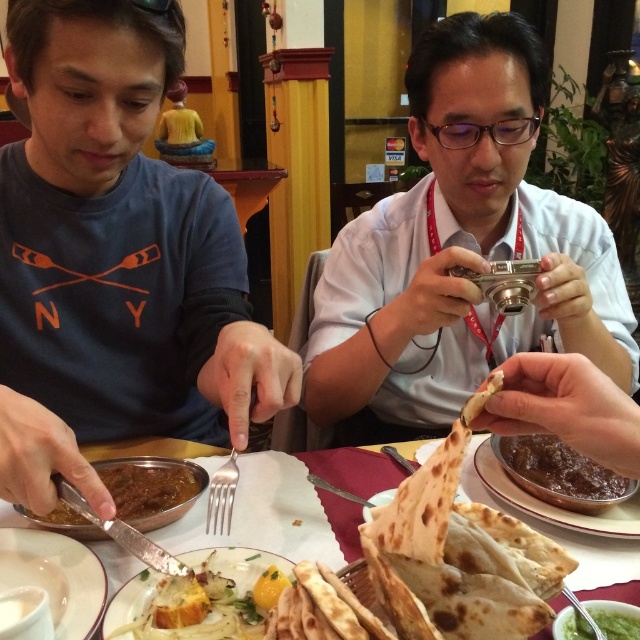
Question: Which point is closer to the camera?

Choices:
 (A) pyautogui.click(x=161, y=508)
 (B) pyautogui.click(x=330, y=467)

Answer: (A)

Question: Does white ceramic plate at center appear on the left side of white creamy bread at center?

Choices:
 (A) no
 (B) yes

Answer: (A)

Question: Which point appears farthest from the camera in this image?

Choices:
 (A) (506, 452)
 (B) (184, 481)
 (C) (570, 637)
 (D) (150, 612)

Answer: (A)

Question: Is matte blue shirt at left positioned at the back of green smoothie at center?

Choices:
 (A) yes
 (B) no

Answer: (B)

Question: Based on their relative distances, which object is nearer to the matte blue shirt at left?

Choices:
 (A) brown matte curry at center
 (B) white matte plate at lower left
 (C) silver metallic camera at center
 (D) green smoothie at center

Answer: (B)

Question: Is white ceramic plate at center thinner than green smoothie at center?

Choices:
 (A) no
 (B) yes

Answer: (A)